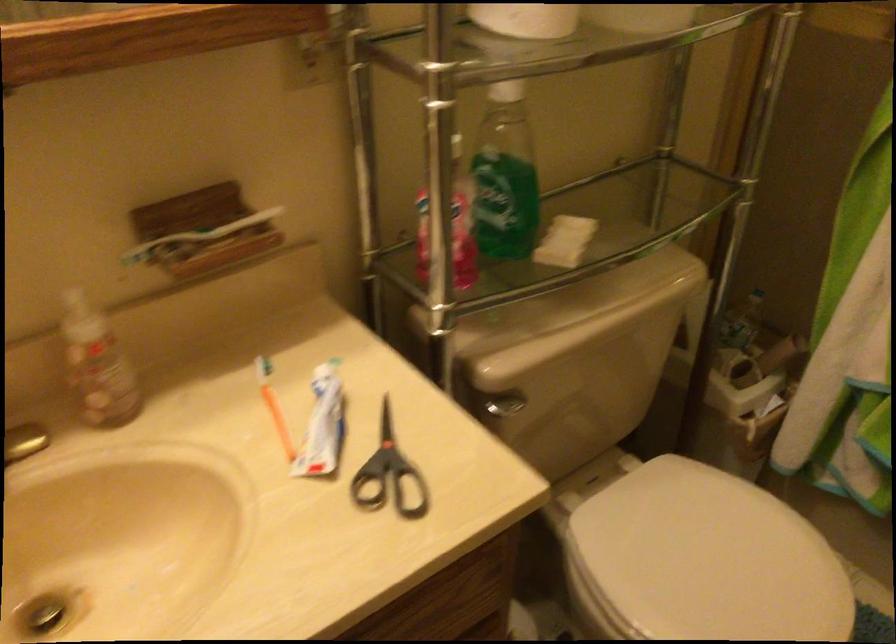
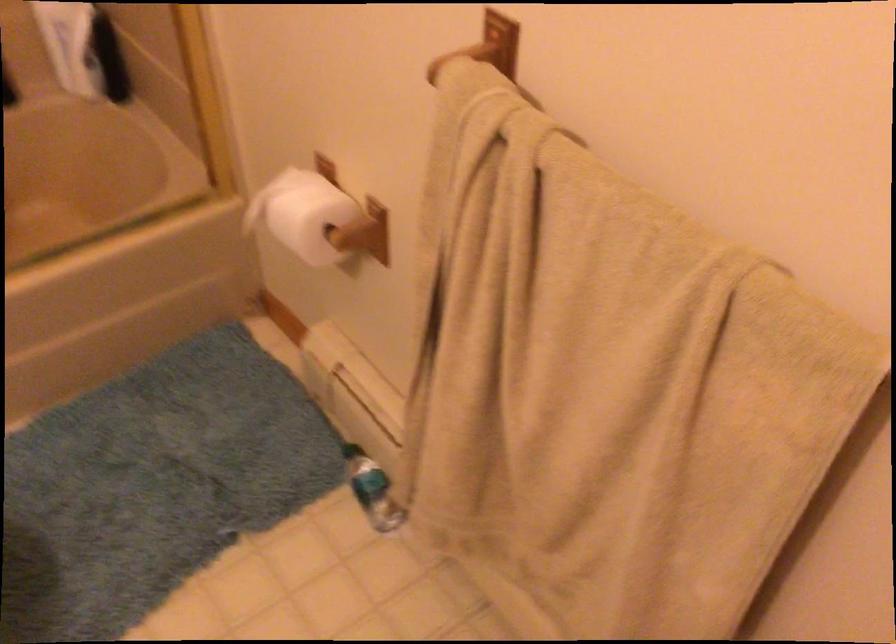
The first image is from the beginning of the video and the second image is from the end. How did the camera likely rotate when shooting the video?

The rotation direction of the camera is right-down.